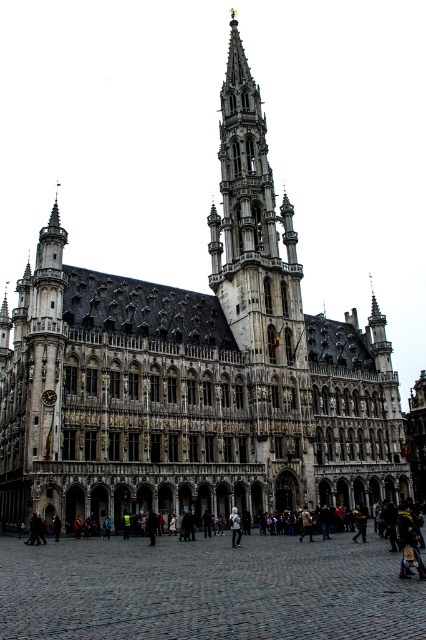
Question: Which point is closer to the camera taking this photo?

Choices:
 (A) 236,525
 (B) 414,580

Answer: (B)

Question: Does brown cobblestone at center have a smaller size compared to dark clothing at center?

Choices:
 (A) no
 (B) yes

Answer: (B)

Question: Where is brown cobblestone at center located in relation to dark clothing at center in the image?

Choices:
 (A) left
 (B) right

Answer: (B)

Question: Which point is closer to the camera taking this photo?

Choices:
 (A) (140, 593)
 (B) (235, 534)
 (C) (54, 600)

Answer: (C)

Question: Which point is farther to the camera?

Choices:
 (A) brown cobblestone at center
 (B) white fabric person at center
 (C) dark clothing at center

Answer: (B)

Question: Is brown cobblestone at center closer to camera compared to dark clothing at center?

Choices:
 (A) no
 (B) yes

Answer: (B)